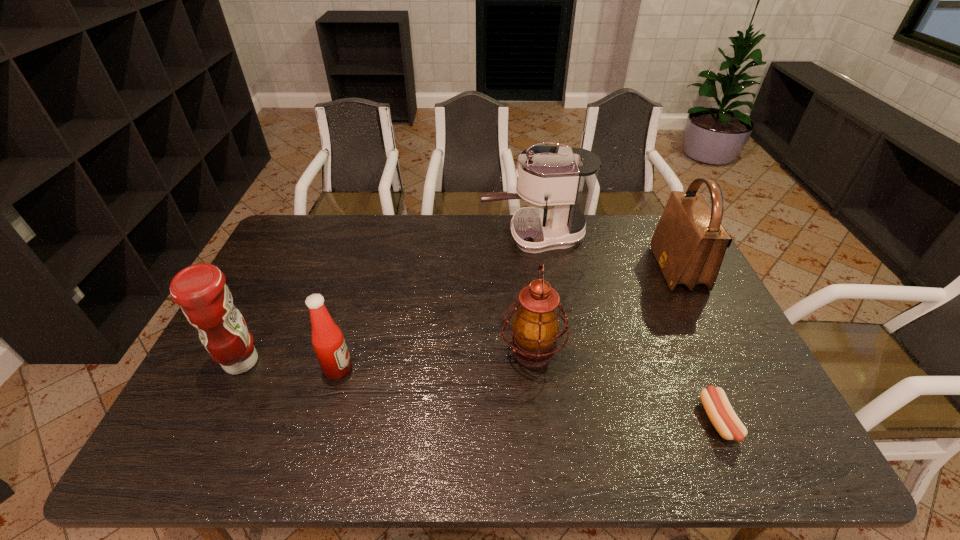
Where is `object located at the near edge`? object located at the near edge is located at coordinates (715, 402).

You are a GUI agent. You are given a task and a screenshot of the screen. Output one action in this format:
    pyautogui.click(x=<x>, y=<y>)
    Task: Click on the object at the left edge
    The width and height of the screenshot is (960, 540).
    Given the screenshot: What is the action you would take?
    pyautogui.click(x=200, y=289)

Where is `shoulder bag that is at the right edge`? Image resolution: width=960 pixels, height=540 pixels. shoulder bag that is at the right edge is located at coordinates (689, 243).

The height and width of the screenshot is (540, 960). I want to click on sausage situated at the right edge, so click(x=715, y=402).

The width and height of the screenshot is (960, 540). I want to click on object located at the far right corner, so click(x=689, y=243).

Where is `object located at the near right corner`? object located at the near right corner is located at coordinates (715, 402).

In the image, there is a desktop. Where is `vacant space at the far edge`? Image resolution: width=960 pixels, height=540 pixels. vacant space at the far edge is located at coordinates [365, 219].

At what (x,y) coordinates should I click in order to perform the action: click on vacant space at the left edge of the desktop. Please return your answer as a coordinate pair (x, y). Looking at the image, I should click on (232, 408).

Image resolution: width=960 pixels, height=540 pixels. In order to click on vacant region at the right edge of the desktop in this screenshot , I will do tap(714, 325).

Where is `free space at the far left corner of the desktop`? The width and height of the screenshot is (960, 540). free space at the far left corner of the desktop is located at coordinates (329, 221).